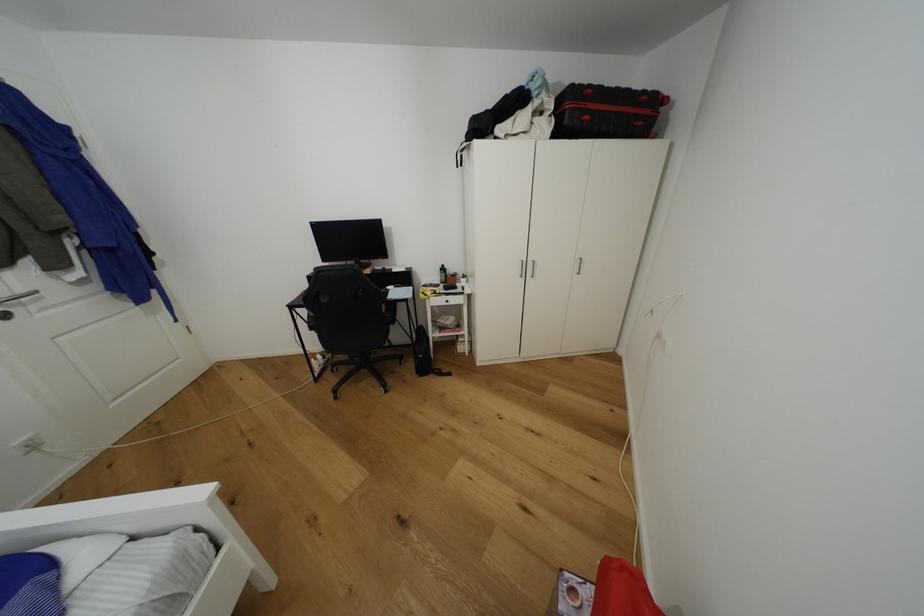
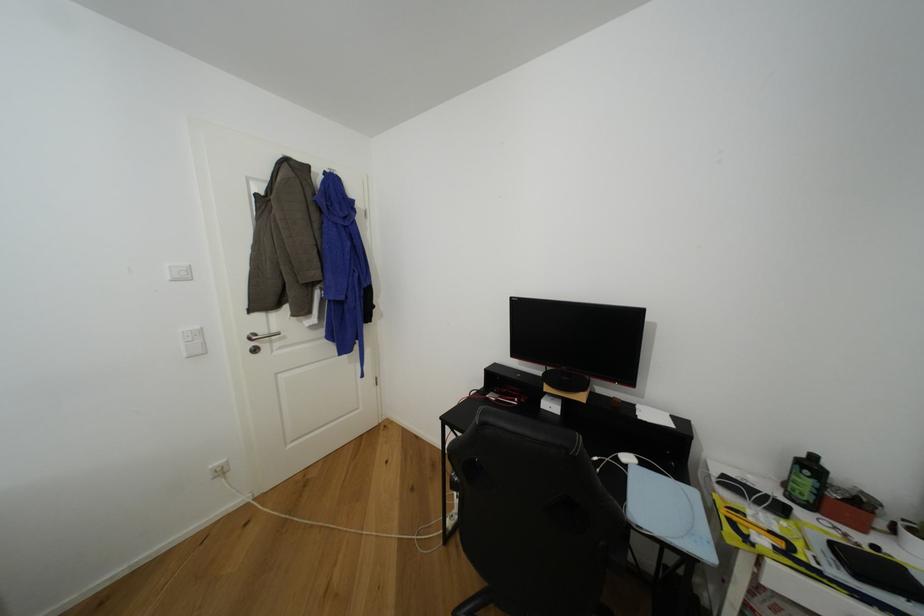
Locate, in the second image, the point that corresponds to point (447, 267) in the first image.

(820, 459)